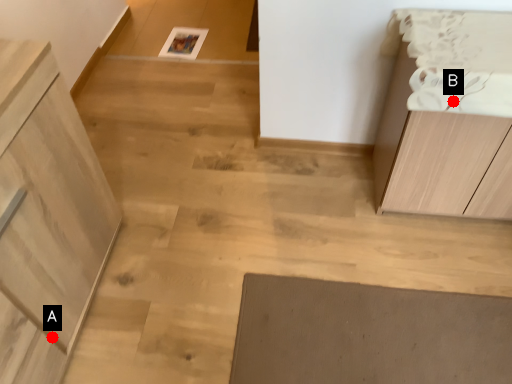
Question: Two points are circled on the image, labeled by A and B beside each circle. Among these points, which one is nearest to the camera?

Choices:
 (A) A is closer
 (B) B is closer

Answer: (B)